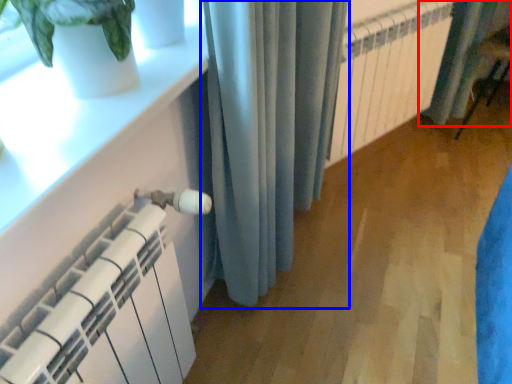
Question: Which of the following is the closest to the observer, curtain (highlighted by a red box) or curtain (highlighted by a blue box)?

Choices:
 (A) curtain
 (B) curtain

Answer: (B)